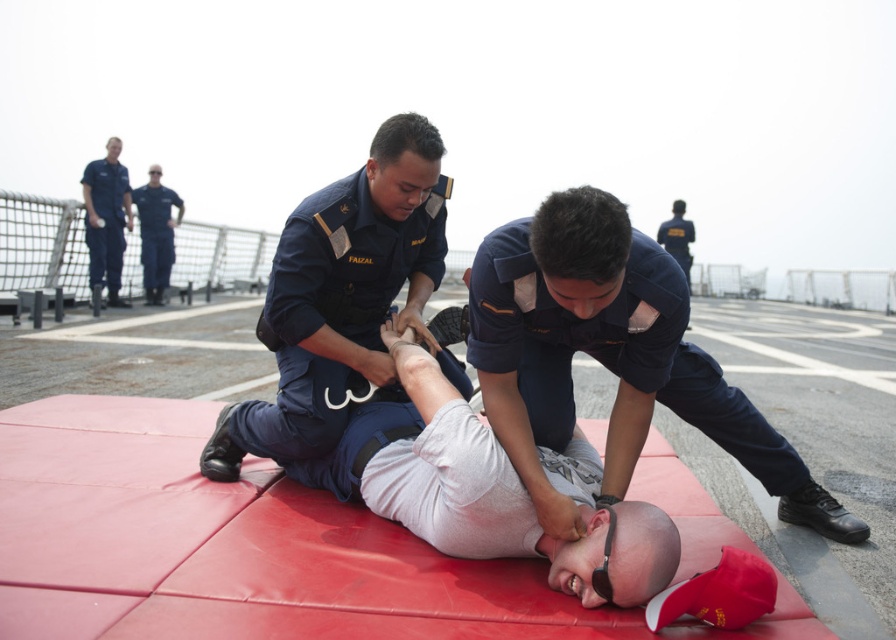
Question: Does blue uniform at upper left have a lesser width compared to dark blue uniform at upper left?

Choices:
 (A) yes
 (B) no

Answer: (A)

Question: Which point is farther to the camera?

Choices:
 (A) dark blue uniform at upper left
 (B) navy blue uniform at center

Answer: (A)

Question: Can you confirm if dark blue uniform at center is wider than navy blue uniform at center?

Choices:
 (A) yes
 (B) no

Answer: (B)

Question: Which object appears closest to the camera in this image?

Choices:
 (A) navy blue uniform at center
 (B) dark blue uniform at upper left
 (C) dark blue uniform at center
 (D) blue uniform at upper left

Answer: (C)

Question: Which of the following is the closest to the observer?

Choices:
 (A) blue uniform at upper left
 (B) dark blue uniform at center
 (C) navy blue uniform at center

Answer: (B)

Question: Can you confirm if dark blue uniform at center is positioned to the left of dark blue uniform at upper left?

Choices:
 (A) yes
 (B) no

Answer: (B)